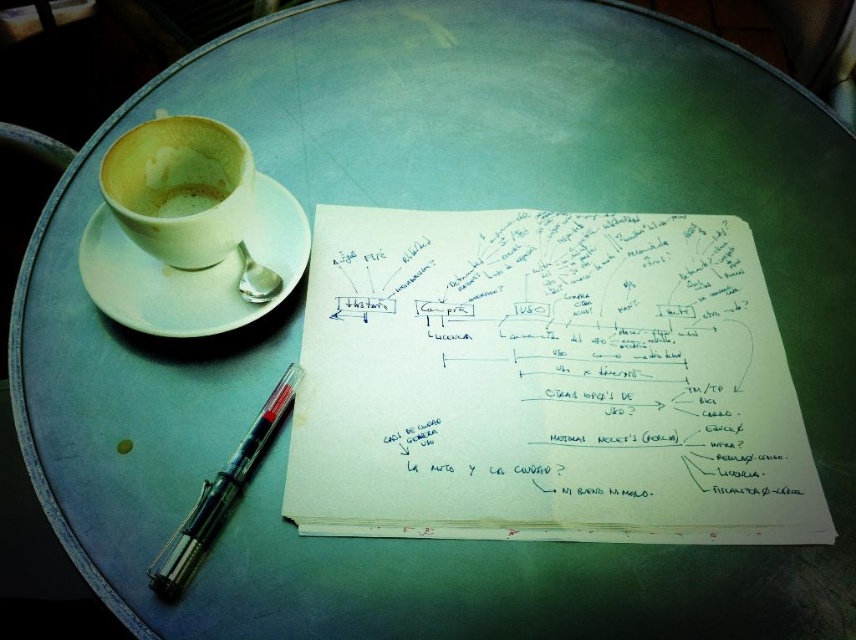
You are a barista preparing a drink and need to place both the white ceramic saucer at upper left and the white matte cup at upper left on a shelf. The shelf has limited vertical space. Which object should you place first to ensure both fit without exceeding the shelf height?

The white ceramic saucer at upper left is much taller than the white matte cup at upper left, so you should place the white matte cup at upper left first to leave enough vertical space for the taller saucer.

You are organizing the items on the table and need to place the black metallic pen at lower left closer to the edge. Can you move the white matte cup at upper left to access it?

The white matte cup at upper left is positioned over the black metallic pen at lower left, so you need to move the white matte cup at upper left first to access the black metallic pen at lower left.

You are organizing items on a round light blue table. You need to place both the white matte cup at upper left and the black metallic pen at lower left. According to their current positions, which item is closer to the center of the table?

The white matte cup at upper left is closer to the center of the table than the black metallic pen at lower left because the pen is positioned behind the cup, indicating it is further away from the center.